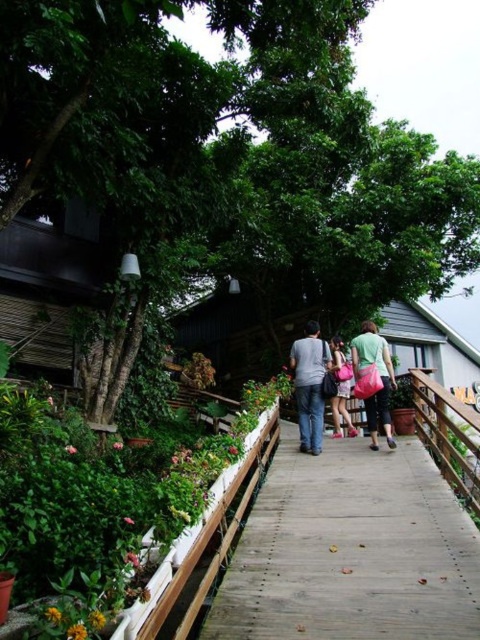
Between wooden walkway at center and denim jeans at center, which one has less height?

With less height is wooden walkway at center.

Is wooden walkway at center behind denim jeans at center?

No, wooden walkway at center is closer to the viewer.

Who is more forward, (230, 572) or (319, 426)?

Point (230, 572) is more forward.

At what (x,y) coordinates should I click in order to perform the action: click on wooden walkway at center. Please return your answer as a coordinate pair (x, y). The height and width of the screenshot is (640, 480). Looking at the image, I should click on (350, 550).

Can you confirm if matte green shirt at center is bigger than pink fabric bag at center?

No, matte green shirt at center is not bigger than pink fabric bag at center.

In order to click on matte green shirt at center in this screenshot , I will do `click(380, 376)`.

This screenshot has height=640, width=480. Find the location of `matte green shirt at center`. matte green shirt at center is located at coordinates (380, 376).

Is denim jeans at center smaller than matte green shirt at center?

Yes, denim jeans at center is smaller than matte green shirt at center.

Which of these two, denim jeans at center or matte green shirt at center, stands taller?

denim jeans at center is taller.

Which is behind, point (304, 449) or point (352, 356)?

Positioned behind is point (304, 449).

Identify the location of denim jeans at center. (310, 385).